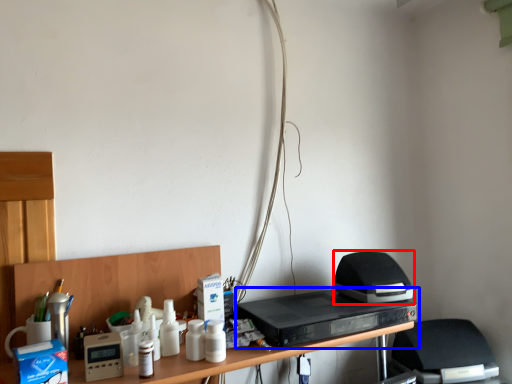
Question: Which object appears farthest to the camera in this image, appliance (highlighted by a red box) or home appliance (highlighted by a blue box)?

Choices:
 (A) appliance
 (B) home appliance

Answer: (A)